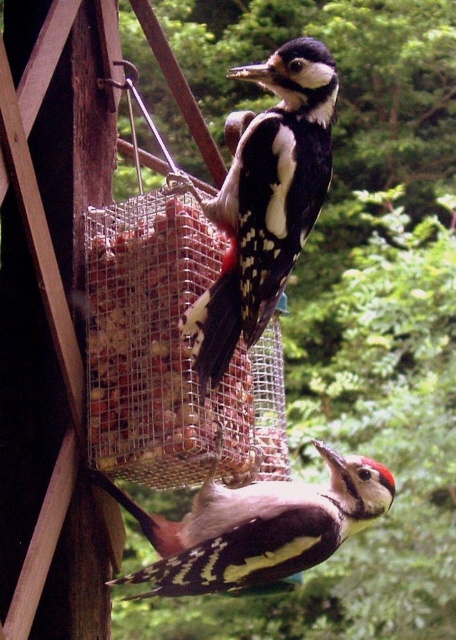
Question: Among these objects, which one is nearest to the camera?

Choices:
 (A) speckled brown woodpecker at center
 (B) smooth mesh container at center
 (C) speckled brown woodpecker at lower center

Answer: (A)

Question: Is speckled brown woodpecker at center in front of speckled brown woodpecker at lower center?

Choices:
 (A) no
 (B) yes

Answer: (B)

Question: Which point is farther to the camera?

Choices:
 (A) (222, 531)
 (B) (109, 237)
 (C) (267, 132)

Answer: (B)

Question: Which object is farther from the camera taking this photo?

Choices:
 (A) speckled brown woodpecker at lower center
 (B) speckled brown woodpecker at center

Answer: (A)

Question: In this image, where is smooth mesh container at center located relative to speckled brown woodpecker at center?

Choices:
 (A) left
 (B) right

Answer: (A)

Question: Where is smooth mesh container at center located in relation to speckled brown woodpecker at center in the image?

Choices:
 (A) left
 (B) right

Answer: (A)